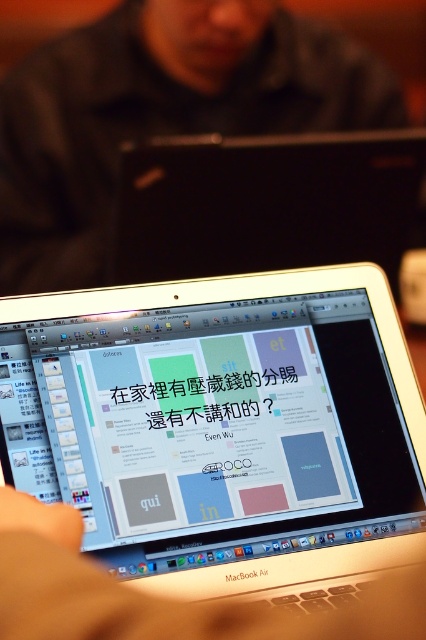
Question: Which object appears closest to the camera in this image?

Choices:
 (A) black matte laptop at center
 (B) white plastic laptop at center
 (C) silver metallic laptop at center

Answer: (C)

Question: Is silver metallic laptop at center thinner than black matte laptop at center?

Choices:
 (A) no
 (B) yes

Answer: (B)

Question: Based on their relative distances, which object is farther from the silver metallic laptop at center?

Choices:
 (A) white plastic laptop at center
 (B) black matte laptop at center

Answer: (B)

Question: Which point is closer to the camera?

Choices:
 (A) (287, 32)
 (B) (399, 406)
 (C) (206, 204)

Answer: (B)

Question: Can you confirm if silver metallic laptop at center is positioned below black matte laptop at center?

Choices:
 (A) yes
 (B) no

Answer: (A)

Question: From the image, what is the correct spatial relationship of silver metallic laptop at center in relation to white plastic laptop at center?

Choices:
 (A) right
 (B) left

Answer: (B)